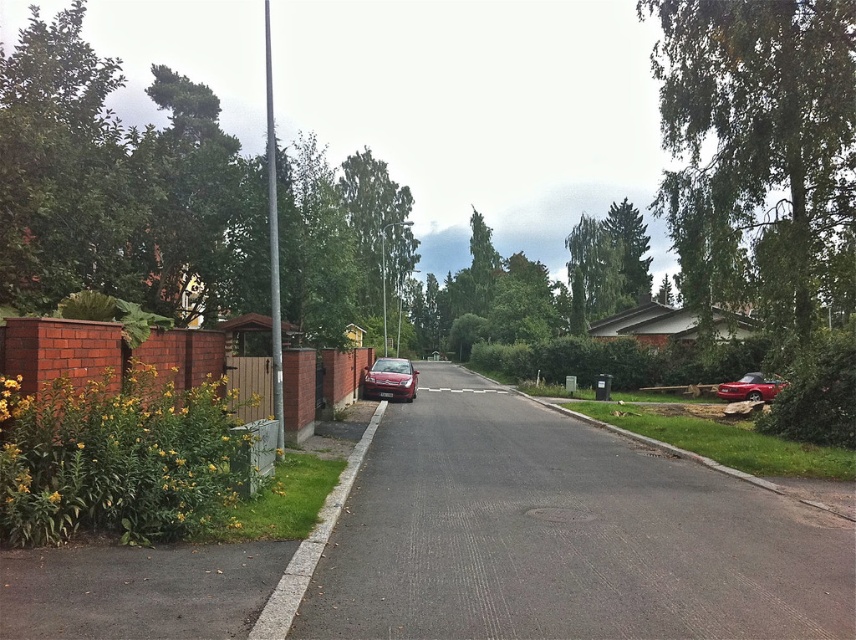
You are a pedestrian standing at the edge of the road. You notice a glossy red car at center and a satin silver sedan at center. Which car is positioned lower in the image?

The glossy red car at center is positioned lower than the satin silver sedan at center in the image.

You are a delivery person trying to navigate through the residential street. You see a green leafy tree at upper right and a glossy metallic car at right. Which object is taller?

The green leafy tree at upper right is taller than the glossy metallic car at right according to the description.

You are a delivery driver trying to park your glossy red car at center in the residential area. The green leafy tree at upper right is in the way. Can you park the car without hitting the tree?

The glossy red car at center occupies less space than the green leafy tree at upper right, so yes, you can park the glossy red car at center without hitting the green leafy tree at upper right since it takes up less space.